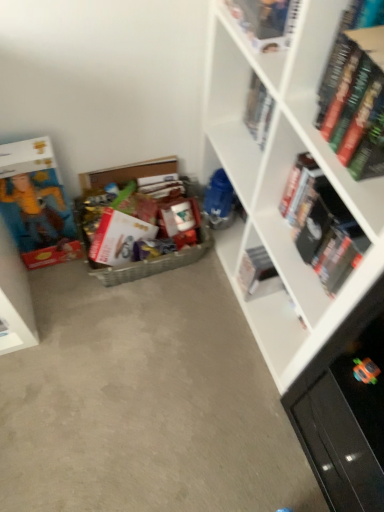
Question: From a real-world perspective, is matte cardboard box at left positioned above or below hardcover book at upper center, which appears as the third book when viewed from the left?

Choices:
 (A) below
 (B) above

Answer: (A)

Question: Is matte cardboard box at left in front of or behind hardcover book at upper center, the fourth book when ordered from right to left, in the image?

Choices:
 (A) behind
 (B) front

Answer: (B)

Question: Considering the real-world distances, which object is farthest from the hardcover book at upper right, which is the second book in right-to-left order?

Choices:
 (A) hardcover book at upper center, which appears as the third book when viewed from the left
 (B) hardcover book at upper right, which appears as the sixth book when viewed from the left
 (C) white matte book at center, the 4th book viewed from the left
 (D) white matte bookcase at right
 (E) matte cardboard box at center

Answer: (E)

Question: Which object is positioned closest to the hardcover book at upper right, positioned as the 1th book in right-to-left order?

Choices:
 (A) multicolored cardboard box at center, which ranks as the 6th book in right-to-left order
 (B) white matte book at center, the 4th book viewed from the left
 (C) matte cardboard box at center
 (D) hardcover book at upper right, which is the 5th book from left to right
 (E) hardcover book at upper center, the fourth book when ordered from right to left

Answer: (D)